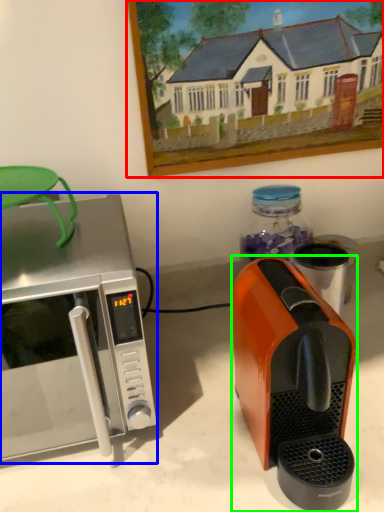
Question: Which object is positioned closest to picture frame (highlighted by a red box)? Select from microwave oven (highlighted by a blue box) and coffee maker (highlighted by a green box).

Choices:
 (A) microwave oven
 (B) coffee maker

Answer: (A)